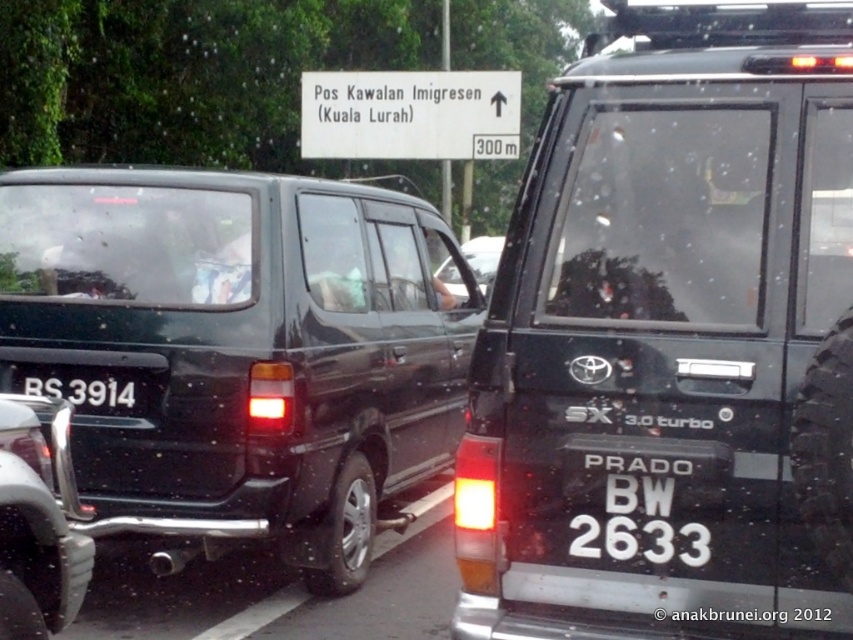
You are a driver approaching the white plastic license plate at center and the white plastic sign at upper center. Which object will you see first as you drive closer to them?

The white plastic sign at upper center is located above the white plastic license plate at center, so you will see the white plastic sign at upper center first as you approach them because it is higher up and visible earlier.

You are a driver approaching the Immigration Control Post. You see a white plastic sign at upper center and a white plastic license plate at center. Which object is bigger in size?

The white plastic sign at upper center is larger in size compared to the white plastic license plate at center.